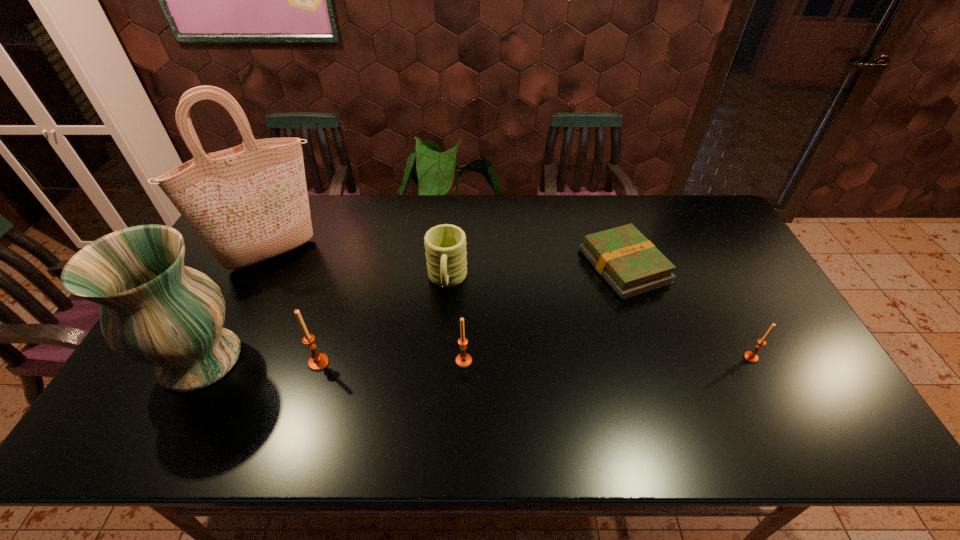
This screenshot has width=960, height=540. Find the location of `free spot that satisfies the following two spatial constraints: 1. on the front side of the second tallest candle_holder; 2. on the left side of the shopping bag`. free spot that satisfies the following two spatial constraints: 1. on the front side of the second tallest candle_holder; 2. on the left side of the shopping bag is located at coordinates (221, 361).

The width and height of the screenshot is (960, 540). Identify the location of vacant region that satisfies the following two spatial constraints: 1. on the back side of the second candle_holder from right to left; 2. on the left side of the rightmost candle_holder. (464, 357).

Where is `free spot that satisfies the following two spatial constraints: 1. on the back side of the vase; 2. on the right side of the shortest object`? The height and width of the screenshot is (540, 960). free spot that satisfies the following two spatial constraints: 1. on the back side of the vase; 2. on the right side of the shortest object is located at coordinates (251, 266).